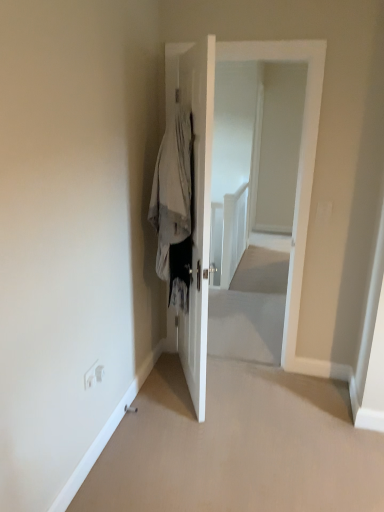
Question: From the image's perspective, is white glossy door at center, placed as the 1th door when sorted from left to right, beneath white glossy door at center, marked as the second door in a left-to-right arrangement?

Choices:
 (A) yes
 (B) no

Answer: (A)

Question: Is the position of white glossy door at center, placed as the 1th door when sorted from left to right, more distant than that of white glossy door at center, which is the first door in right-to-left order?

Choices:
 (A) yes
 (B) no

Answer: (B)

Question: Does white glossy door at center, placed as the 1th door when sorted from left to right, have a lesser height compared to white glossy door at center, marked as the second door in a left-to-right arrangement?

Choices:
 (A) yes
 (B) no

Answer: (A)

Question: Can you confirm if white glossy door at center, placed as the 1th door when sorted from left to right, is positioned to the right of white glossy door at center, which is the first door in right-to-left order?

Choices:
 (A) yes
 (B) no

Answer: (B)

Question: Can you confirm if white glossy door at center, positioned as the 2th door in right-to-left order, is positioned to the left of white glossy door at center, which is the first door in right-to-left order?

Choices:
 (A) no
 (B) yes

Answer: (B)

Question: From the image's perspective, is white glossy door at center, which is the first door in right-to-left order, above or below white glossy door at center, positioned as the 2th door in right-to-left order?

Choices:
 (A) above
 (B) below

Answer: (A)

Question: Relative to white glossy door at center, placed as the 1th door when sorted from left to right, is white glossy door at center, marked as the second door in a left-to-right arrangement, in front or behind?

Choices:
 (A) behind
 (B) front

Answer: (A)

Question: Considering the positions of point (206, 238) and point (203, 56), is point (206, 238) closer or farther from the camera than point (203, 56)?

Choices:
 (A) closer
 (B) farther

Answer: (B)

Question: Based on their sizes in the image, would you say white glossy door at center, marked as the second door in a left-to-right arrangement, is bigger or smaller than white glossy door at center, placed as the 1th door when sorted from left to right?

Choices:
 (A) big
 (B) small

Answer: (A)

Question: Is light gray fabric coat at center taller or shorter than white glossy door at center, positioned as the 2th door in right-to-left order?

Choices:
 (A) short
 (B) tall

Answer: (A)

Question: In the image, is light gray fabric coat at center on the left side or the right side of white glossy door at center, placed as the 1th door when sorted from left to right?

Choices:
 (A) right
 (B) left

Answer: (B)

Question: From the image's perspective, is light gray fabric coat at center located above or below white glossy door at center, positioned as the 2th door in right-to-left order?

Choices:
 (A) below
 (B) above

Answer: (B)

Question: Is light gray fabric coat at center wider or thinner than white glossy door at center, placed as the 1th door when sorted from left to right?

Choices:
 (A) wide
 (B) thin

Answer: (A)

Question: Considering the positions of white glossy door at center, placed as the 1th door when sorted from left to right, and white glossy door at center, marked as the second door in a left-to-right arrangement, in the image, is white glossy door at center, placed as the 1th door when sorted from left to right, wider or thinner than white glossy door at center, marked as the second door in a left-to-right arrangement,?

Choices:
 (A) wide
 (B) thin

Answer: (B)

Question: Based on their sizes in the image, would you say white glossy door at center, positioned as the 2th door in right-to-left order, is bigger or smaller than white glossy door at center, marked as the second door in a left-to-right arrangement?

Choices:
 (A) small
 (B) big

Answer: (A)